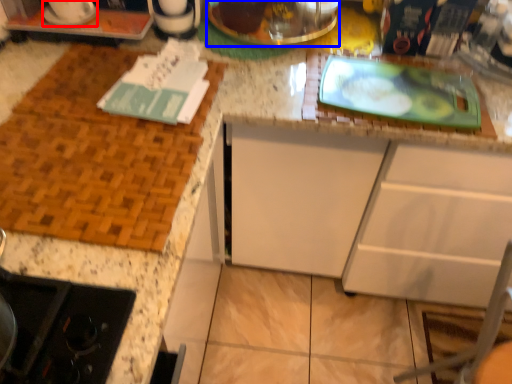
Question: Which point is closer to the camera, appliance (highlighted by a red box) or appliance (highlighted by a blue box)?

Choices:
 (A) appliance
 (B) appliance

Answer: (A)